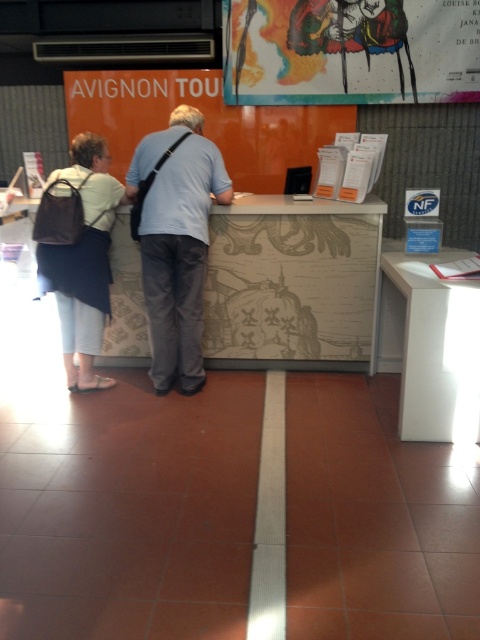
Can you confirm if colorful painted figure at upper center is taller than white glossy table at lower right?

No.

Is the position of colorful painted figure at upper center more distant than that of white glossy table at lower right?

That is True.

I want to click on colorful painted figure at upper center, so click(x=350, y=51).

Identify the location of colorful painted figure at upper center. This screenshot has width=480, height=640. (350, 51).

Can you confirm if beige textured desk at center is positioned below white glossy table at lower right?

Actually, beige textured desk at center is above white glossy table at lower right.

Is beige textured desk at center thinner than white glossy table at lower right?

No.

Does point (350, 360) come farther from viewer compared to point (436, 340)?

Yes, point (350, 360) is farther from viewer.

Where is `beige textured desk at center`? The width and height of the screenshot is (480, 640). beige textured desk at center is located at coordinates [292, 284].

Is point (308, 227) closer to camera compared to point (95, 227)?

No, (308, 227) is behind (95, 227).

Does point (333, 307) come in front of point (108, 168)?

No, it is not.

This screenshot has width=480, height=640. I want to click on beige textured desk at center, so (292, 284).